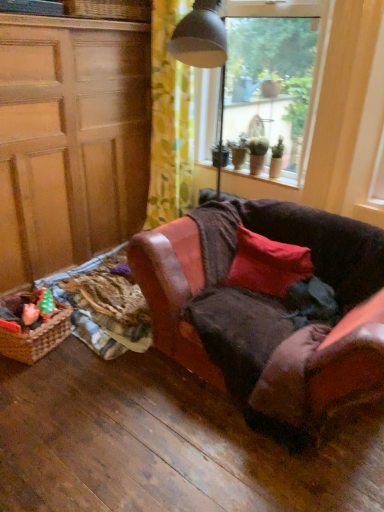
Question: Does green matte houseplant at upper right, acting as the 2th houseplant starting from the left, turn towards plush pink toy at lower left?

Choices:
 (A) no
 (B) yes

Answer: (A)

Question: Is green matte houseplant at upper right, acting as the 2th houseplant starting from the left, not inside plush pink toy at lower left?

Choices:
 (A) no
 (B) yes

Answer: (B)

Question: From a real-world perspective, is green matte houseplant at upper right, which appears as the 1th houseplant when viewed from the right, located higher than plush pink toy at lower left?

Choices:
 (A) yes
 (B) no

Answer: (A)

Question: Considering the relative sizes of green matte houseplant at upper right, which appears as the 1th houseplant when viewed from the right, and plush pink toy at lower left in the image provided, is green matte houseplant at upper right, which appears as the 1th houseplant when viewed from the right, taller than plush pink toy at lower left?

Choices:
 (A) yes
 (B) no

Answer: (A)

Question: Can you confirm if green matte houseplant at upper right, acting as the 2th houseplant starting from the left, is bigger than plush pink toy at lower left?

Choices:
 (A) no
 (B) yes

Answer: (A)

Question: Does green matte houseplant at upper right, which appears as the 1th houseplant when viewed from the right, contain plush pink toy at lower left?

Choices:
 (A) no
 (B) yes

Answer: (A)

Question: Is the depth of plush pink toy at lower left less than that of smooth wooden window sill at upper center?

Choices:
 (A) no
 (B) yes

Answer: (B)

Question: Does plush pink toy at lower left have a lesser width compared to smooth wooden window sill at upper center?

Choices:
 (A) yes
 (B) no

Answer: (A)

Question: From the image's perspective, is plush pink toy at lower left located beneath smooth wooden window sill at upper center?

Choices:
 (A) yes
 (B) no

Answer: (A)

Question: Can you confirm if plush pink toy at lower left is smaller than smooth wooden window sill at upper center?

Choices:
 (A) no
 (B) yes

Answer: (B)

Question: Is plush pink toy at lower left shorter than smooth wooden window sill at upper center?

Choices:
 (A) yes
 (B) no

Answer: (B)

Question: Is plush pink toy at lower left touching smooth wooden window sill at upper center?

Choices:
 (A) yes
 (B) no

Answer: (B)

Question: Does yellow floral fabric at upper center contain woven wicker basket at upper left?

Choices:
 (A) yes
 (B) no

Answer: (B)